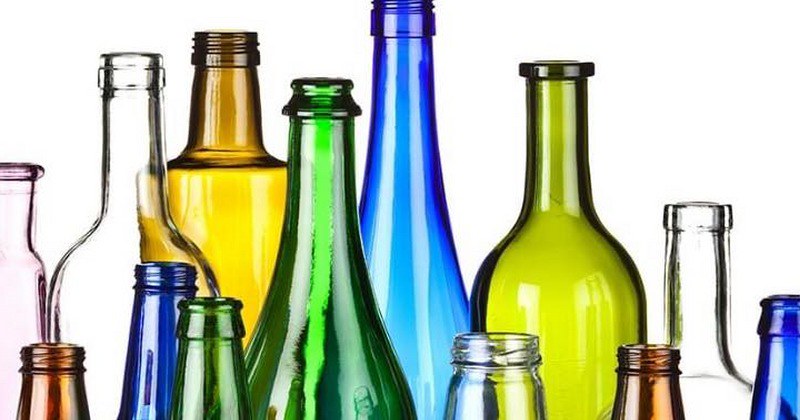
This screenshot has width=800, height=420. I want to click on clear bottles, so click(x=494, y=403), click(x=678, y=317), click(x=150, y=200), click(x=22, y=204).